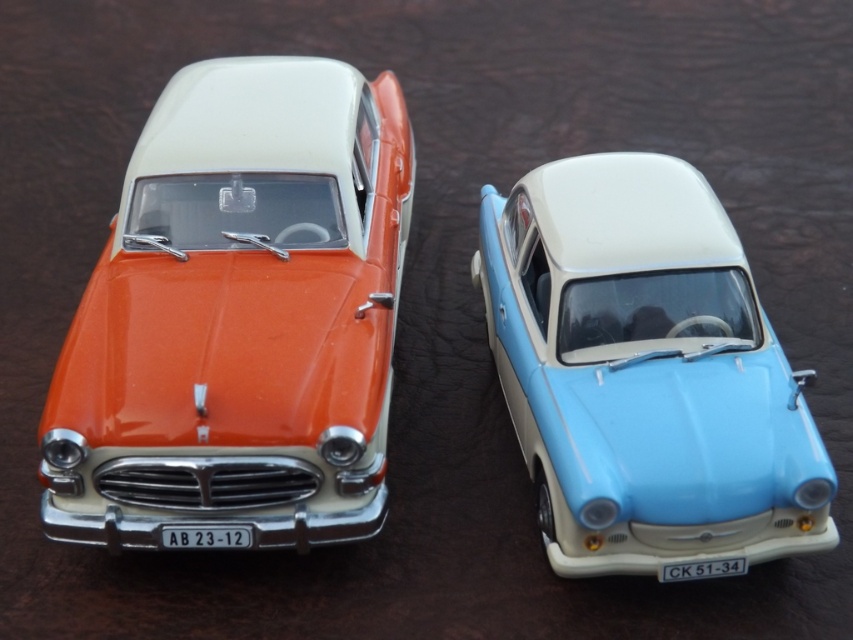
Question: Which object is farther from the camera taking this photo?

Choices:
 (A) light blue plastic car at center
 (B) orange glossy car at left

Answer: (B)

Question: Is orange glossy car at left to the left of light blue plastic car at center from the viewer's perspective?

Choices:
 (A) no
 (B) yes

Answer: (B)

Question: Is orange glossy car at left positioned behind light blue plastic car at center?

Choices:
 (A) yes
 (B) no

Answer: (A)

Question: Is orange glossy car at left smaller than light blue plastic car at center?

Choices:
 (A) yes
 (B) no

Answer: (B)